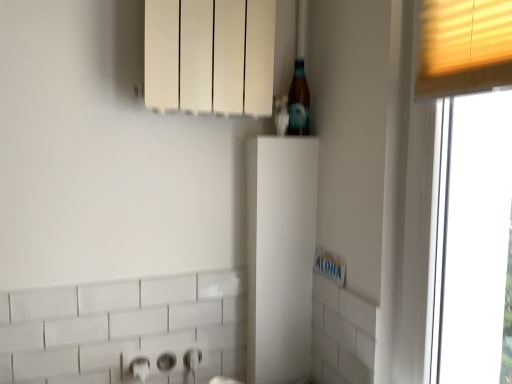
Question: Is white matte radiator at upper center, marked as the 1th cabinetry in a top-to-bottom arrangement, taller or shorter than translucent glass bottle at upper right?

Choices:
 (A) short
 (B) tall

Answer: (B)

Question: Is white matte radiator at upper center, placed as the second cabinetry when sorted from bottom to top, bigger or smaller than translucent glass bottle at upper right?

Choices:
 (A) small
 (B) big

Answer: (B)

Question: Which of these objects is positioned closest to the white matte radiator at upper center, placed as the second cabinetry when sorted from bottom to top?

Choices:
 (A) white matte cabinet at center, positioned as the 1th cabinetry in bottom-to-top order
 (B) translucent glass bottle at upper right

Answer: (B)

Question: Which object is positioned farthest from the white matte cabinet at center, positioned as the 1th cabinetry in bottom-to-top order?

Choices:
 (A) white matte radiator at upper center, marked as the 1th cabinetry in a top-to-bottom arrangement
 (B) translucent glass bottle at upper right

Answer: (A)